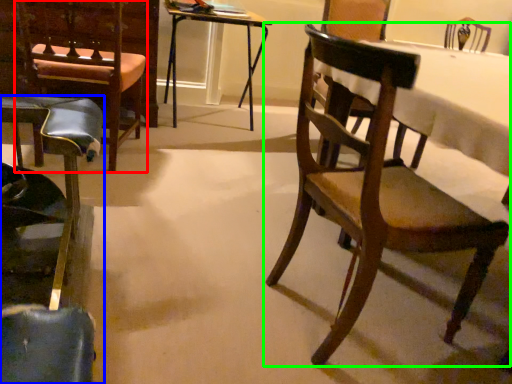
Question: Estimate the real-world distances between objects in this image. Which object is farther from armchair (highlighted by a red box), chair (highlighted by a blue box) or chair (highlighted by a green box)?

Choices:
 (A) chair
 (B) chair

Answer: (B)